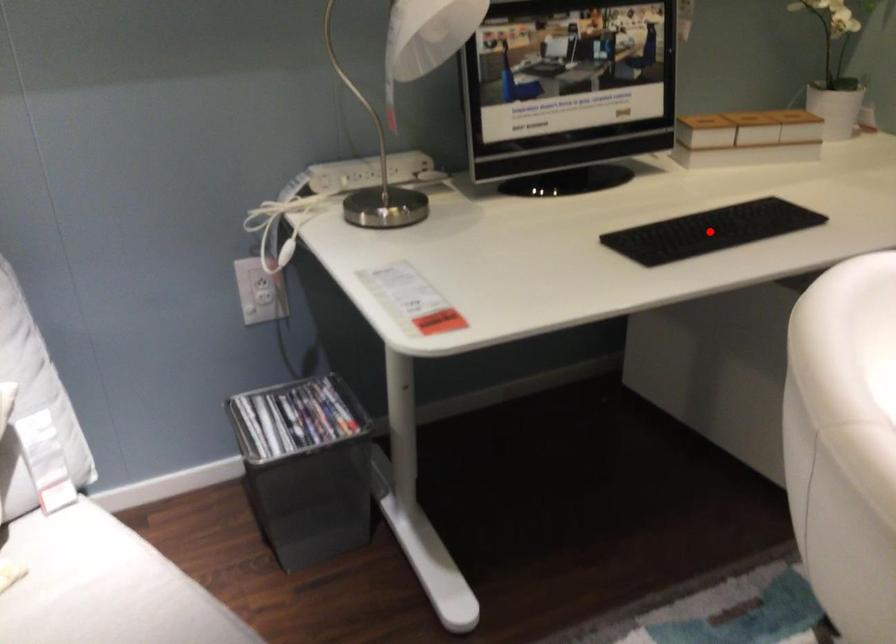
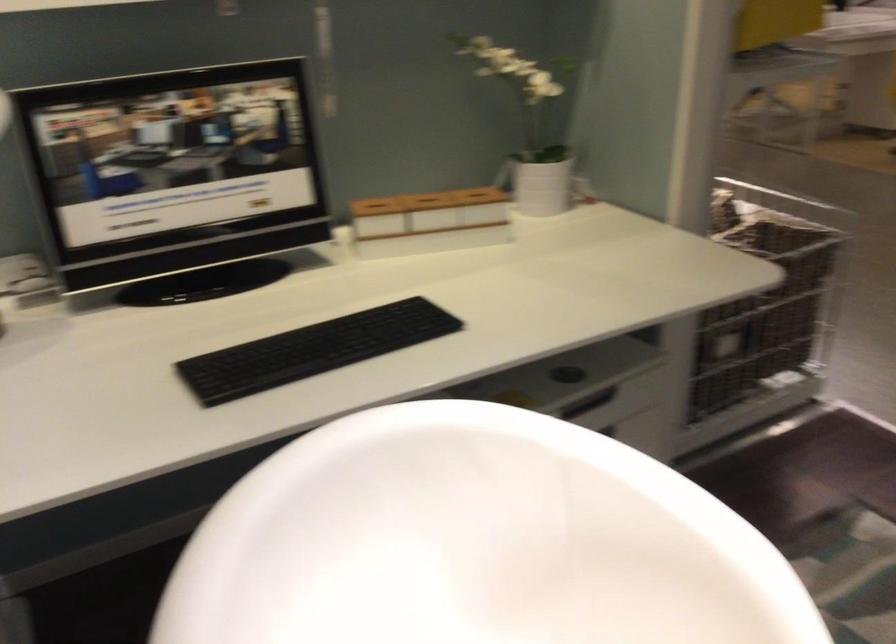
Where in the second image is the point corresponding to the highlighted location from the first image?

(313, 350)